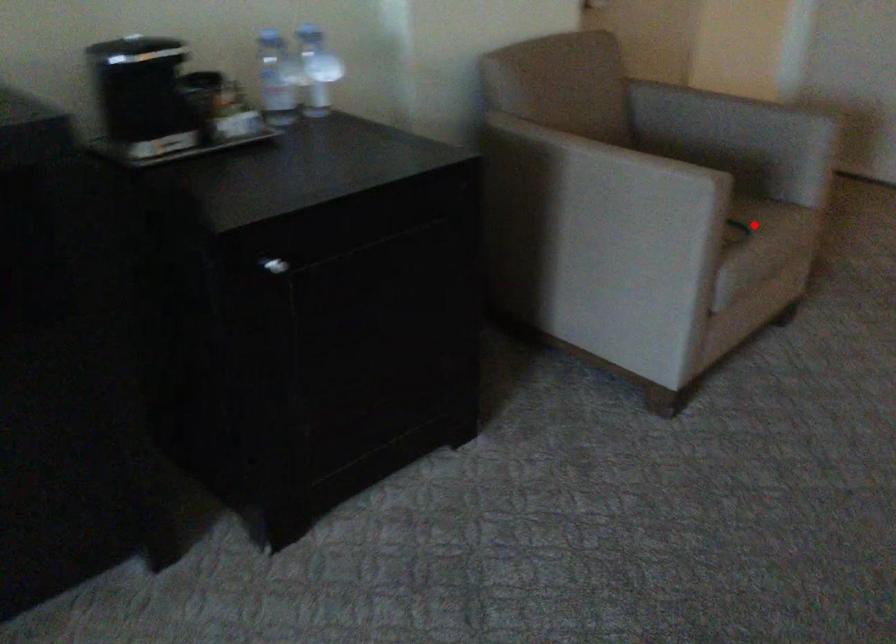
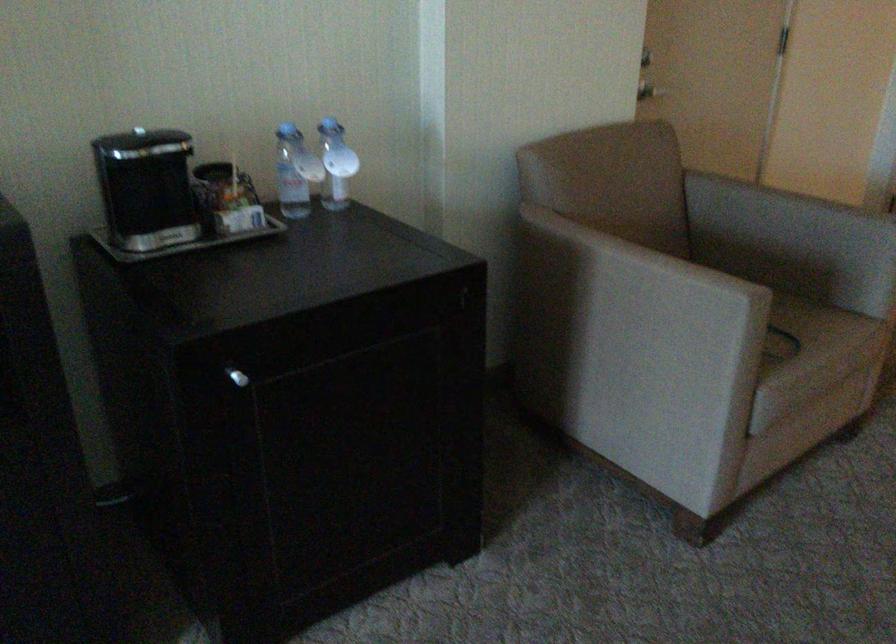
The point at the highlighted location is marked in the first image. Where is the corresponding point in the second image?

(811, 335)